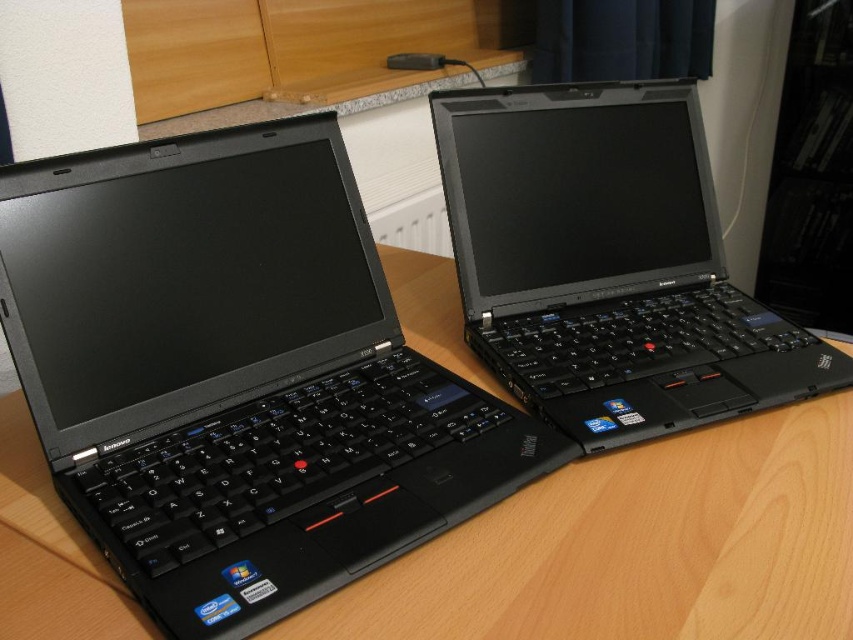
You are organizing a tech event and need to place a 15 cm wide promotional banner between the wooden table at center and the black matte laptop at upper right. Based on their positions, can you determine which side of the laptop the banner should be placed on?

The wooden table at center is positioned on the left side of black matte laptop at upper right, so the banner should be placed on the left side of the black matte laptop at upper right to fit between them.

You are setting up a workspace and need to place both the wooden table at center and the black matte laptop at upper right. Given their sizes, which object should you prioritize placing first to ensure there is enough space for both?

The wooden table at center is larger in size than the black matte laptop at upper right, so you should prioritize placing the wooden table at center first to ensure there is enough space for both.

Based on the photo, you are standing at the edge of the wooden table and want to place a small item at the point labeled as point (637, 547). Based on the scene description, where exactly on the wooden table at center would this point be located?

The point (637, 547) on the wooden table at center is located near the right edge of the table, slightly towards the back.